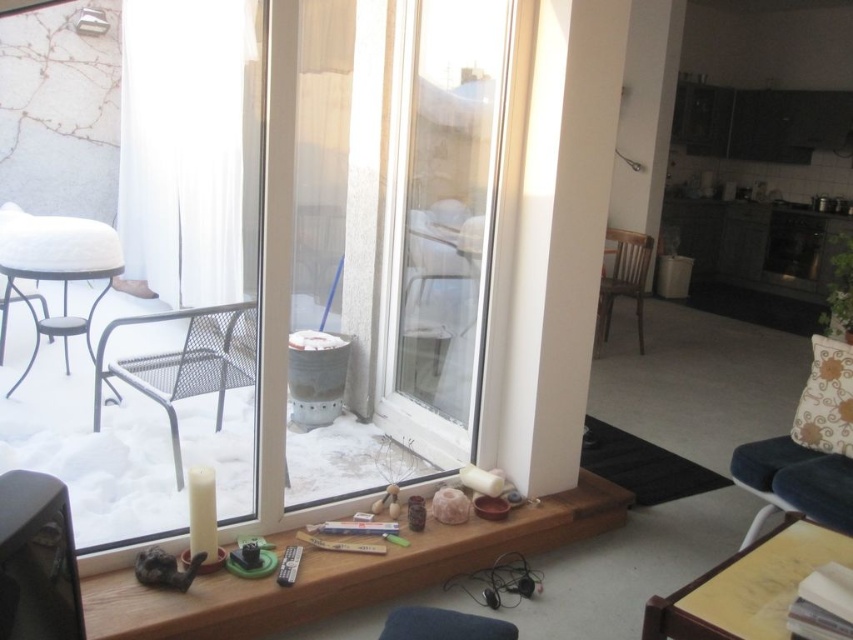
Question: In this image, where is wooden at lower center located relative to metal mesh armchair at left?

Choices:
 (A) left
 (B) right

Answer: (B)

Question: Based on their relative distances, which object is farther from the metal mesh armchair at left?

Choices:
 (A) gray plastic stool at left
 (B) transparent glass window at center
 (C) velvet blue armchair at right

Answer: (C)

Question: Can you confirm if transparent glass window at center is positioned to the right of wooden chair at center?

Choices:
 (A) yes
 (B) no

Answer: (B)

Question: Which point appears closest to the camera in this image?

Choices:
 (A) (71, 260)
 (B) (614, 243)
 (C) (409, 582)

Answer: (C)

Question: Which of the following is the farthest from the observer?

Choices:
 (A) wooden at lower center
 (B) gray plastic stool at left
 (C) wooden chair at center

Answer: (C)

Question: Does wooden at lower center appear on the right side of metal mesh armchair at left?

Choices:
 (A) no
 (B) yes

Answer: (B)